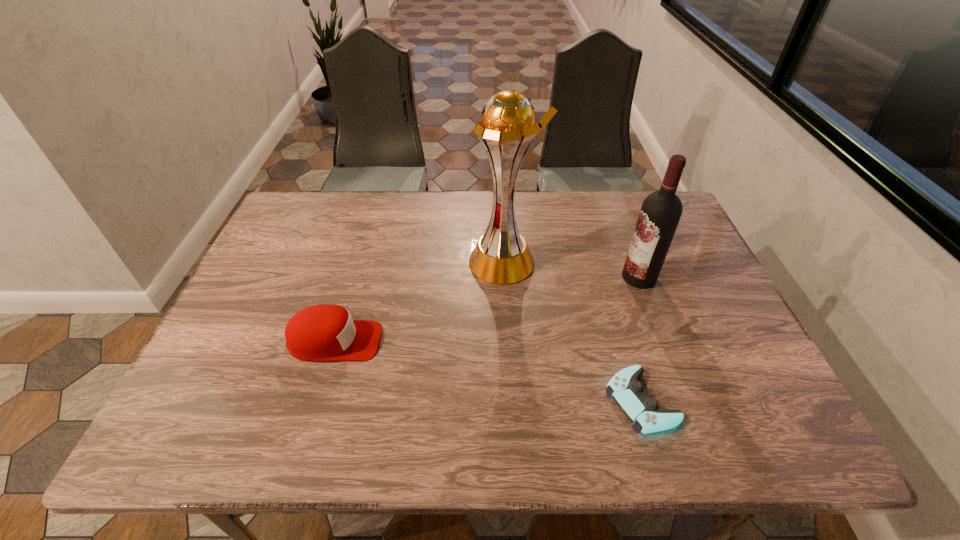
The image size is (960, 540). In the image, there is a desktop. Identify the location of vacant space at the right edge. (696, 356).

You are a GUI agent. You are given a task and a screenshot of the screen. Output one action in this format:
    pyautogui.click(x=<x>, y=<y>)
    Task: Click on the free space at the far left corner of the desktop
    This screenshot has height=540, width=960.
    Given the screenshot: What is the action you would take?
    pyautogui.click(x=304, y=212)

The height and width of the screenshot is (540, 960). I want to click on vacant space at the near left corner of the desktop, so click(x=194, y=452).

In the image, there is a desktop. Where is `vacant space at the near right corner`? vacant space at the near right corner is located at coordinates (725, 429).

Where is `vacant space that's between the wine bottle and the leftmost object`? The width and height of the screenshot is (960, 540). vacant space that's between the wine bottle and the leftmost object is located at coordinates (487, 309).

At what (x,y) coordinates should I click in order to perform the action: click on vacant space that's between the wine bottle and the third object from right to left. Please return your answer as a coordinate pair (x, y). Image resolution: width=960 pixels, height=540 pixels. Looking at the image, I should click on (571, 269).

The width and height of the screenshot is (960, 540). What are the coordinates of `free area in between the trophy and the shortest object` in the screenshot? It's located at (572, 331).

The width and height of the screenshot is (960, 540). In order to click on blank region between the leftmost object and the third shortest object in this screenshot , I will do `click(487, 309)`.

The height and width of the screenshot is (540, 960). Find the location of `empty space between the third object from right to left and the second tallest object`. empty space between the third object from right to left and the second tallest object is located at coordinates (571, 269).

The image size is (960, 540). In order to click on free spot between the second object from left to right and the third shortest object in this screenshot , I will do `click(571, 269)`.